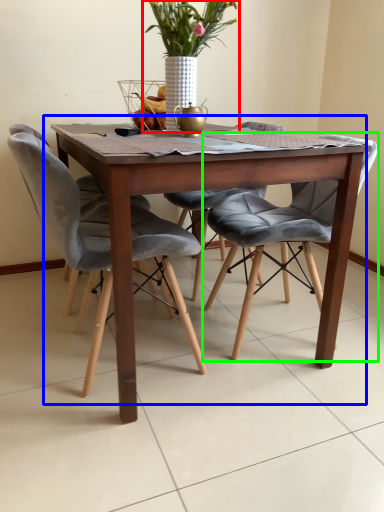
Question: Estimate the real-world distances between objects in this image. Which object is closer to houseplant (highlighted by a red box), kitchen & dining room table (highlighted by a blue box) or chair (highlighted by a green box)?

Choices:
 (A) kitchen & dining room table
 (B) chair

Answer: (A)